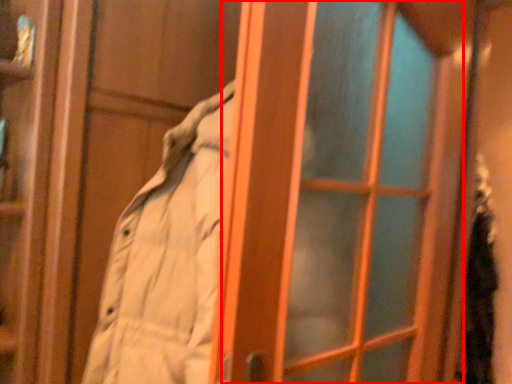
Question: From the image, what is the correct spatial relationship of screen door (annotated by the red box) in relation to person?

Choices:
 (A) right
 (B) left

Answer: (B)